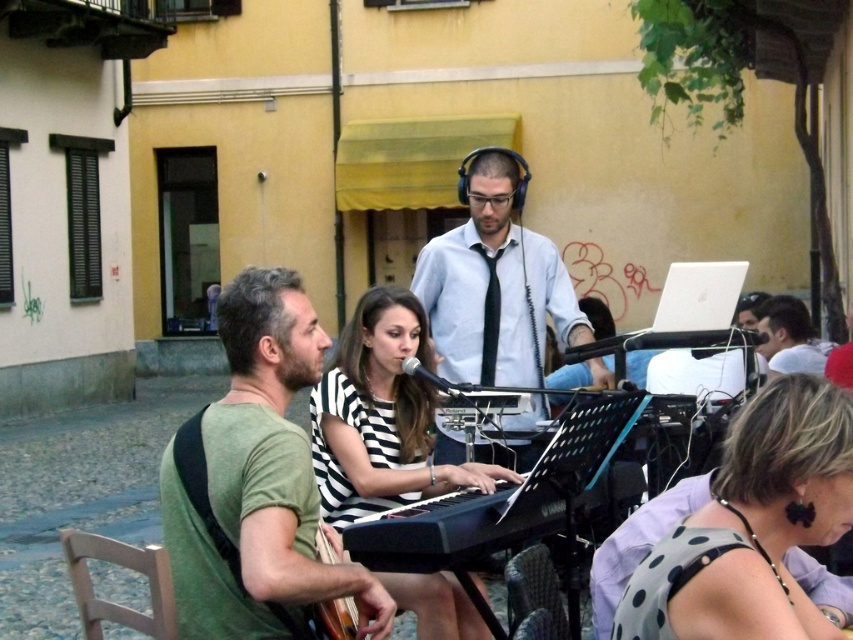
You are a photographer standing in front of the yellow building with a green awning. You want to take a photo of the black and white striped dress at center and the black plastic keyboard at center. Which object should you focus on first if you want to capture both in the same frame without moving the camera?

The black and white striped dress at center is taller than the black plastic keyboard at center, so you should focus on the taller object first to ensure both are in frame.

You are a photographer trying to capture the street performance. You notice the black and white striped dress at center and the light blue shirt at center are both in your frame. Which of the two items appears narrower in the photo?

The black and white striped dress at center appears narrower in the photo compared to the light blue shirt at center since it has a lesser width according to the description.

You are standing on the cobblestone street and see the polka dot fabric dress at lower right and the leather at lower center. Which object is positioned more to the right side of the scene?

The polka dot fabric dress at lower right is positioned more to the right side of the scene than the leather at lower center.